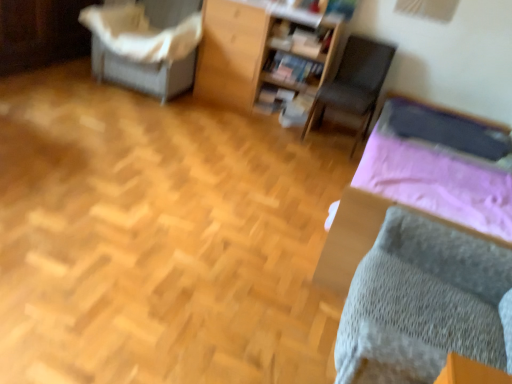
Locate an element on the screen. Image resolution: width=512 pixels, height=384 pixels. blank space to the left of dark gray fabric chair at center is located at coordinates (279, 130).